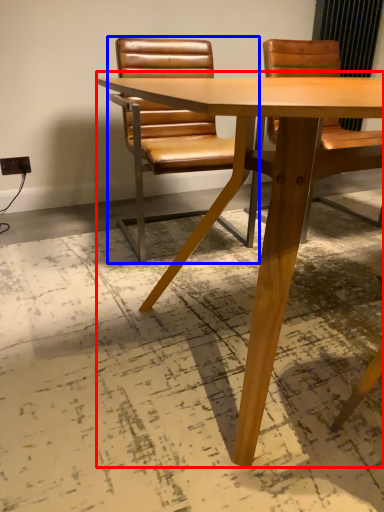
Question: Which point is further to the camera, table (highlighted by a red box) or chair (highlighted by a blue box)?

Choices:
 (A) table
 (B) chair

Answer: (B)